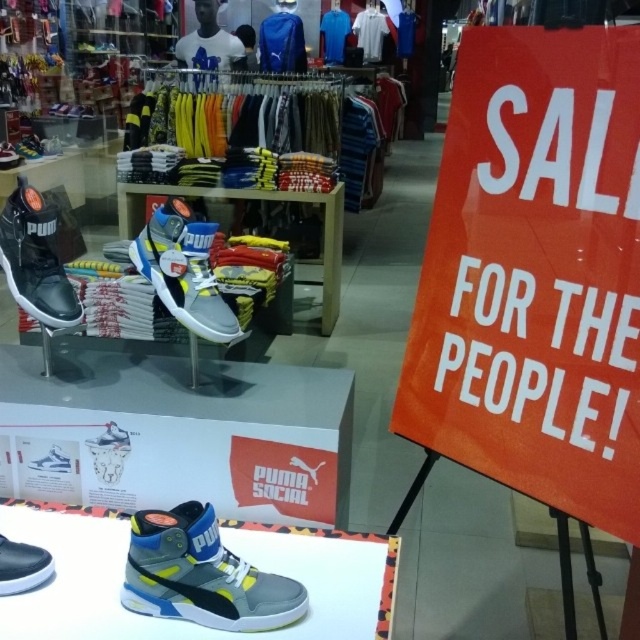
You are a customer in the Puma store and want to buy a pair of sneakers. You see the black matte sneaker at left and the white matte shoe at center. Which one is larger in size?

The black matte sneaker at left is bigger than the white matte shoe at center, so the black matte sneaker at left is larger in size.

You are a customer in the store and want to know which shoe is higher. You see the gray matte sneaker at center and the white matte shoe at center. According to the display, which one is positioned higher?

The gray matte sneaker at center is above the white matte shoe at center, so the gray matte sneaker at center is positioned higher.